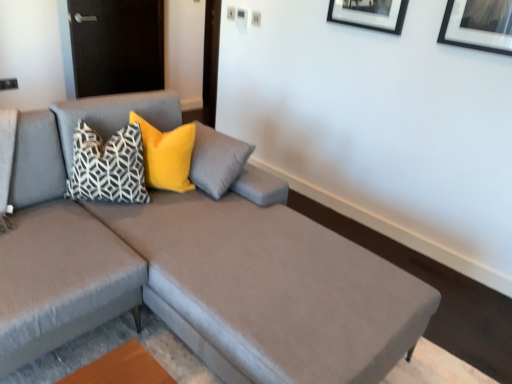
Question: Is geometric-patterned fabric pillow at center, the second pillow in the right-to-left sequence, surrounding textured gray couch at center?

Choices:
 (A) no
 (B) yes

Answer: (A)

Question: Is geometric-patterned fabric pillow at center, the second pillow in the right-to-left sequence, positioned before textured gray couch at center?

Choices:
 (A) no
 (B) yes

Answer: (A)

Question: Could you tell me if geometric-patterned fabric pillow at center, the second pillow in the right-to-left sequence, is turned towards textured gray couch at center?

Choices:
 (A) yes
 (B) no

Answer: (A)

Question: Is geometric-patterned fabric pillow at center, the first pillow from the left, to the left of textured gray couch at center from the viewer's perspective?

Choices:
 (A) no
 (B) yes

Answer: (B)

Question: Is geometric-patterned fabric pillow at center, the first pillow from the left, at the right side of textured gray couch at center?

Choices:
 (A) no
 (B) yes

Answer: (A)

Question: Can you confirm if geometric-patterned fabric pillow at center, the first pillow from the left, is smaller than textured gray couch at center?

Choices:
 (A) yes
 (B) no

Answer: (A)

Question: Considering the relative sizes of velvet yellow pillow at upper left, which is the 2th pillow in left-to-right order, and geometric-patterned fabric pillow at center, the first pillow from the left, in the image provided, is velvet yellow pillow at upper left, which is the 2th pillow in left-to-right order, thinner than geometric-patterned fabric pillow at center, the first pillow from the left,?

Choices:
 (A) yes
 (B) no

Answer: (A)

Question: Considering the relative positions of velvet yellow pillow at upper left, which is the 2th pillow in left-to-right order, and geometric-patterned fabric pillow at center, the first pillow from the left, in the image provided, is velvet yellow pillow at upper left, which is the 2th pillow in left-to-right order, to the left of geometric-patterned fabric pillow at center, the first pillow from the left, from the viewer's perspective?

Choices:
 (A) yes
 (B) no

Answer: (B)

Question: Considering the relative sizes of velvet yellow pillow at upper left, arranged as the first pillow when viewed from the right, and geometric-patterned fabric pillow at center, the first pillow from the left, in the image provided, is velvet yellow pillow at upper left, arranged as the first pillow when viewed from the right, bigger than geometric-patterned fabric pillow at center, the first pillow from the left,?

Choices:
 (A) no
 (B) yes

Answer: (A)

Question: Are velvet yellow pillow at upper left, arranged as the first pillow when viewed from the right, and geometric-patterned fabric pillow at center, the second pillow in the right-to-left sequence, located far from each other?

Choices:
 (A) no
 (B) yes

Answer: (A)

Question: From the image's perspective, is velvet yellow pillow at upper left, which is the 2th pillow in left-to-right order, on geometric-patterned fabric pillow at center, the first pillow from the left?

Choices:
 (A) no
 (B) yes

Answer: (B)

Question: Is the surface of velvet yellow pillow at upper left, which is the 2th pillow in left-to-right order, in direct contact with geometric-patterned fabric pillow at center, the first pillow from the left?

Choices:
 (A) yes
 (B) no

Answer: (B)

Question: From a real-world perspective, is textured gray couch at center physically above geometric-patterned fabric pillow at center, the second pillow in the right-to-left sequence?

Choices:
 (A) yes
 (B) no

Answer: (B)